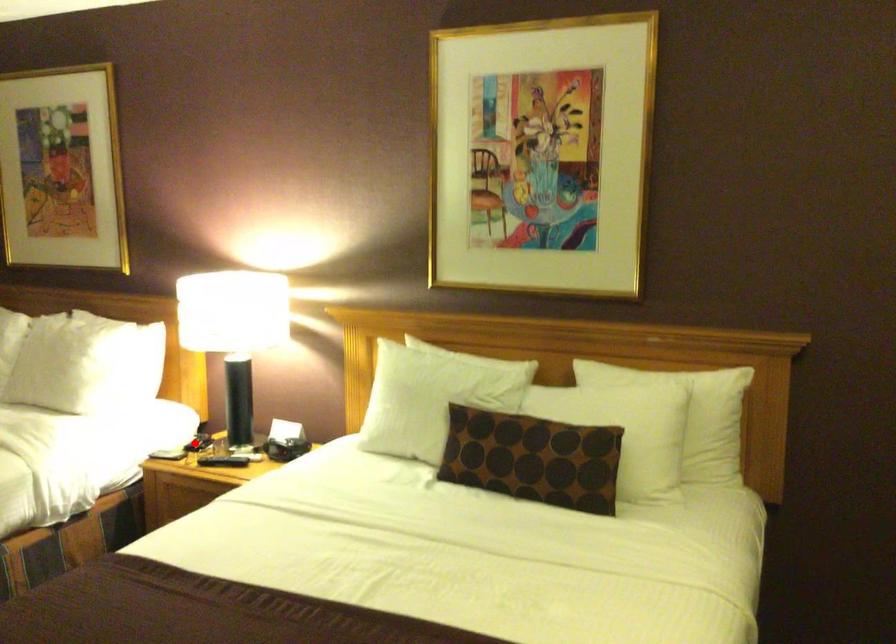
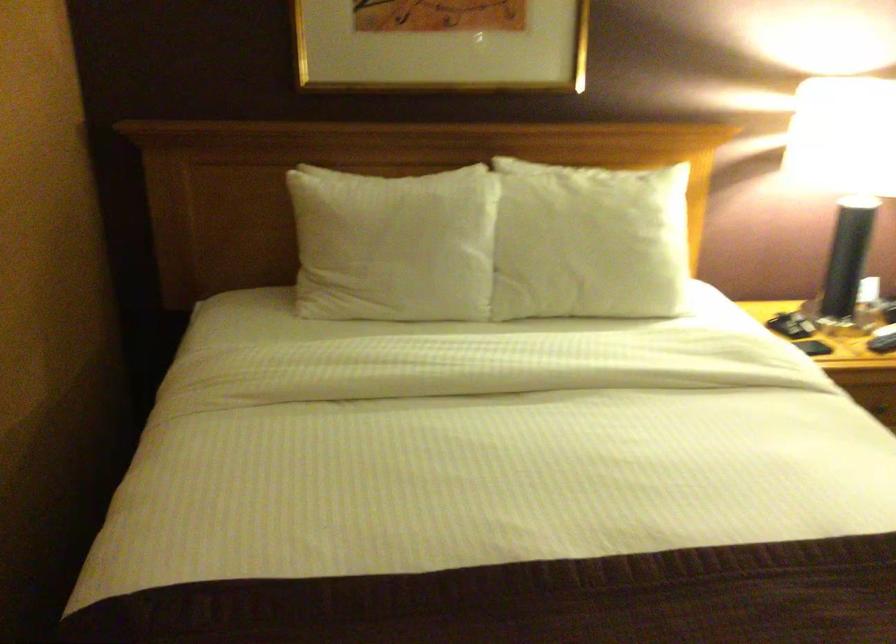
Question: I am providing you with two images of the same scene from different viewpoints. A red point is shown in image1. For the corresponding object point in image2, is it positioned nearer or farther from the camera?

Choices:
 (A) Nearer
 (B) Farther

Answer: (A)